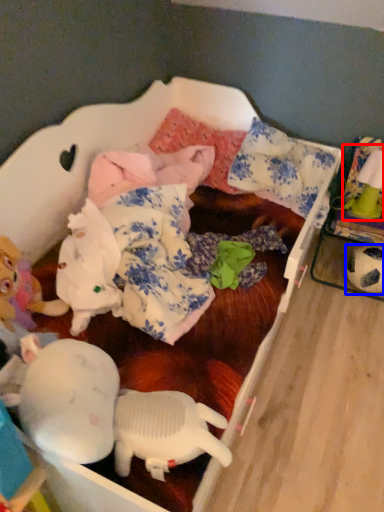
Question: Among these objects, which one is farthest to the camera, toy (highlighted by a red box) or toy (highlighted by a blue box)?

Choices:
 (A) toy
 (B) toy

Answer: (B)